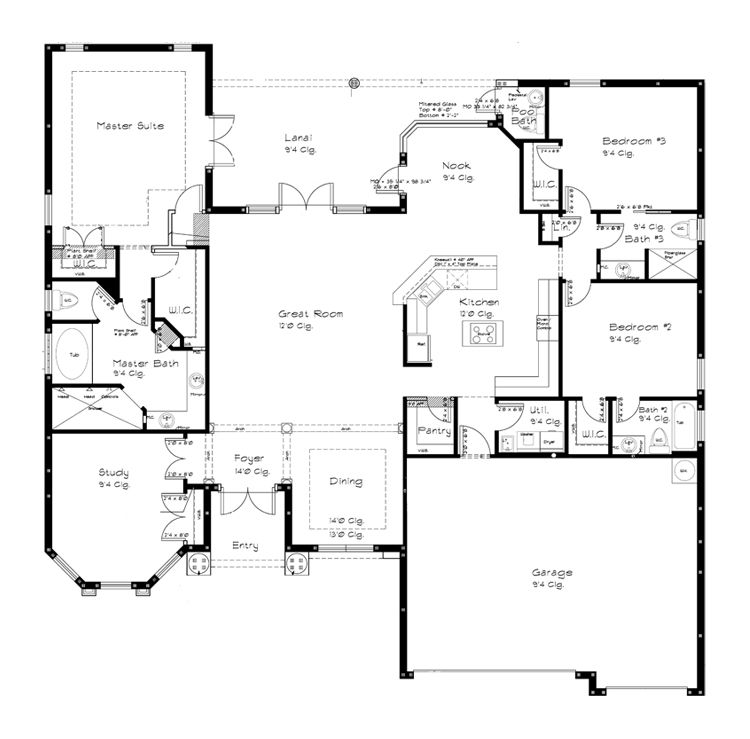
At what (x,y) coordinates should I click in order to perform the action: click on extra rooms. Please return your answer as a coordinate pair (x, y). This screenshot has height=739, width=750. Looking at the image, I should click on (142, 505), (555, 554), (322, 313), (310, 140), (453, 168), (500, 316).